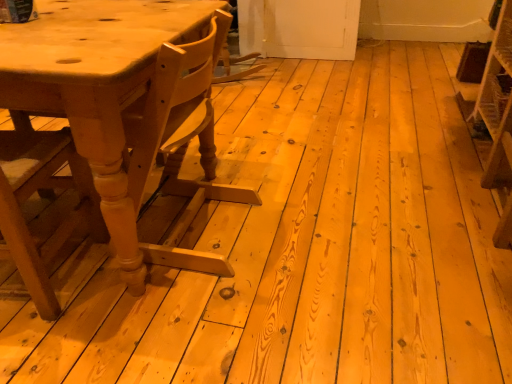
I want to click on vacant area that lies between wooden chair at left and wooden crate at right, so click(335, 206).